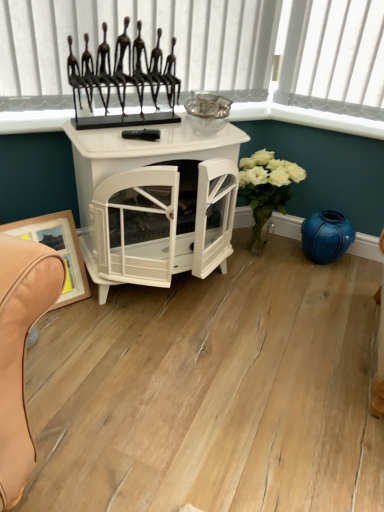
Question: Is white glossy fireplace at center in contact with blue glossy vase at lower right?

Choices:
 (A) yes
 (B) no

Answer: (B)

Question: Does white glossy fireplace at center have a lesser width compared to blue glossy vase at lower right?

Choices:
 (A) yes
 (B) no

Answer: (B)

Question: Can you confirm if white glossy fireplace at center is positioned to the right of blue glossy vase at lower right?

Choices:
 (A) yes
 (B) no

Answer: (B)

Question: Is white glossy fireplace at center not inside blue glossy vase at lower right?

Choices:
 (A) no
 (B) yes

Answer: (B)

Question: Considering the relative sizes of white glossy fireplace at center and blue glossy vase at lower right in the image provided, is white glossy fireplace at center wider than blue glossy vase at lower right?

Choices:
 (A) no
 (B) yes

Answer: (B)

Question: In the image, is metallic black sculpture at upper center positioned in front of or behind white glossy fireplace at center?

Choices:
 (A) front
 (B) behind

Answer: (B)

Question: Is point (223, 83) closer or farther from the camera than point (185, 120)?

Choices:
 (A) closer
 (B) farther

Answer: (B)

Question: Would you say metallic black sculpture at upper center is to the left or to the right of white glossy fireplace at center in the picture?

Choices:
 (A) right
 (B) left

Answer: (B)

Question: In terms of width, does metallic black sculpture at upper center look wider or thinner when compared to white glossy fireplace at center?

Choices:
 (A) thin
 (B) wide

Answer: (A)

Question: Considering the relative positions of wooden framed picture at lower left and metallic black stand at upper center in the image provided, is wooden framed picture at lower left to the left or to the right of metallic black stand at upper center?

Choices:
 (A) right
 (B) left

Answer: (B)

Question: Choose the correct answer: Is wooden framed picture at lower left inside metallic black stand at upper center or outside it?

Choices:
 (A) inside
 (B) outside

Answer: (B)

Question: Looking at the image, does wooden framed picture at lower left seem bigger or smaller compared to metallic black stand at upper center?

Choices:
 (A) small
 (B) big

Answer: (B)

Question: Is wooden framed picture at lower left wider or thinner than metallic black stand at upper center?

Choices:
 (A) thin
 (B) wide

Answer: (A)

Question: Is point (240, 103) positioned closer to the camera than point (56, 239)?

Choices:
 (A) closer
 (B) farther

Answer: (B)

Question: From a real-world perspective, is metallic black stand at upper center physically located above or below wooden framed picture at lower left?

Choices:
 (A) above
 (B) below

Answer: (A)